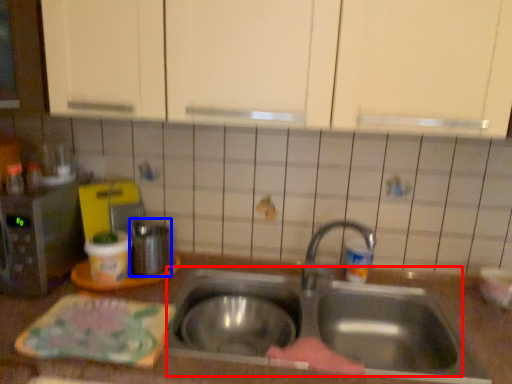
Question: Which object is closer to the camera taking this photo, sink (highlighted by a red box) or appliance (highlighted by a blue box)?

Choices:
 (A) sink
 (B) appliance

Answer: (A)